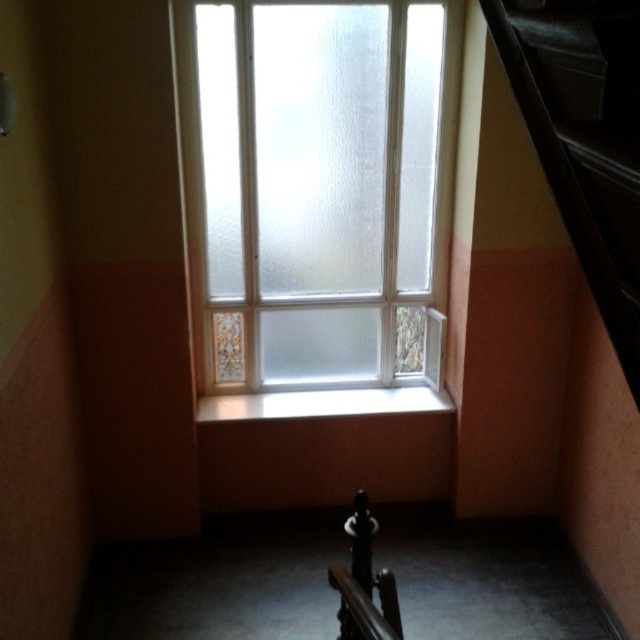
Based on the photo, can you confirm if black leather stairs at right is positioned to the right of white glossy window sill at center?

Correct, you'll find black leather stairs at right to the right of white glossy window sill at center.

This screenshot has height=640, width=640. What do you see at coordinates (584, 138) in the screenshot?
I see `black leather stairs at right` at bounding box center [584, 138].

This screenshot has height=640, width=640. What are the coordinates of `black leather stairs at right` in the screenshot? It's located at (584, 138).

Is frosted glass window at upper center smaller than white glossy window sill at center?

Incorrect, frosted glass window at upper center is not smaller in size than white glossy window sill at center.

Can you confirm if frosted glass window at upper center is bigger than white glossy window sill at center?

Indeed, frosted glass window at upper center has a larger size compared to white glossy window sill at center.

This screenshot has height=640, width=640. I want to click on frosted glass window at upper center, so click(314, 180).

Is black leather stairs at right below polished dark wood handrail at lower center?

No.

Can you confirm if black leather stairs at right is positioned above polished dark wood handrail at lower center?

Indeed, black leather stairs at right is positioned over polished dark wood handrail at lower center.

Is point (548, 17) positioned after point (344, 637)?

No, it is not.

You are a GUI agent. You are given a task and a screenshot of the screen. Output one action in this format:
    pyautogui.click(x=<x>, y=<y>)
    Task: Click on the black leather stairs at right
    
    Given the screenshot: What is the action you would take?
    pyautogui.click(x=584, y=138)